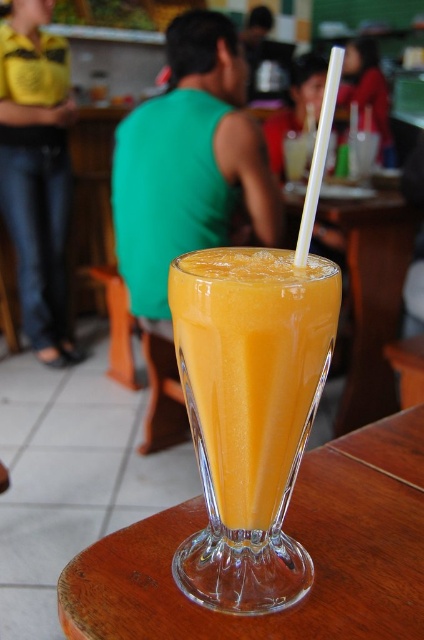
From the picture: Between transparent wood table at center and matte yellow shirt at left, which one is positioned lower?

transparent wood table at center is lower down.

Measure the distance between transparent wood table at center and matte yellow shirt at left.

transparent wood table at center and matte yellow shirt at left are 8.19 feet apart from each other.

Does point (95, 561) come in front of point (36, 12)?

Yes.

Where is `transparent wood table at center`? transparent wood table at center is located at coordinates (292, 536).

Between matte yellow shirt at left and white plastic straw at upper center, which one has less height?

With less height is white plastic straw at upper center.

This screenshot has height=640, width=424. Describe the element at coordinates (36, 172) in the screenshot. I see `matte yellow shirt at left` at that location.

What do you see at coordinates (36, 172) in the screenshot?
I see `matte yellow shirt at left` at bounding box center [36, 172].

Where is `matte yellow shirt at left`? matte yellow shirt at left is located at coordinates (x=36, y=172).

Is point (356, 524) positioned in front of point (228, 285)?

No, it is not.

You are a GUI agent. You are given a task and a screenshot of the screen. Output one action in this format:
    pyautogui.click(x=<x>, y=<y>)
    Task: Click on the transparent wood table at center
    The width and height of the screenshot is (424, 640).
    Given the screenshot: What is the action you would take?
    pyautogui.click(x=292, y=536)